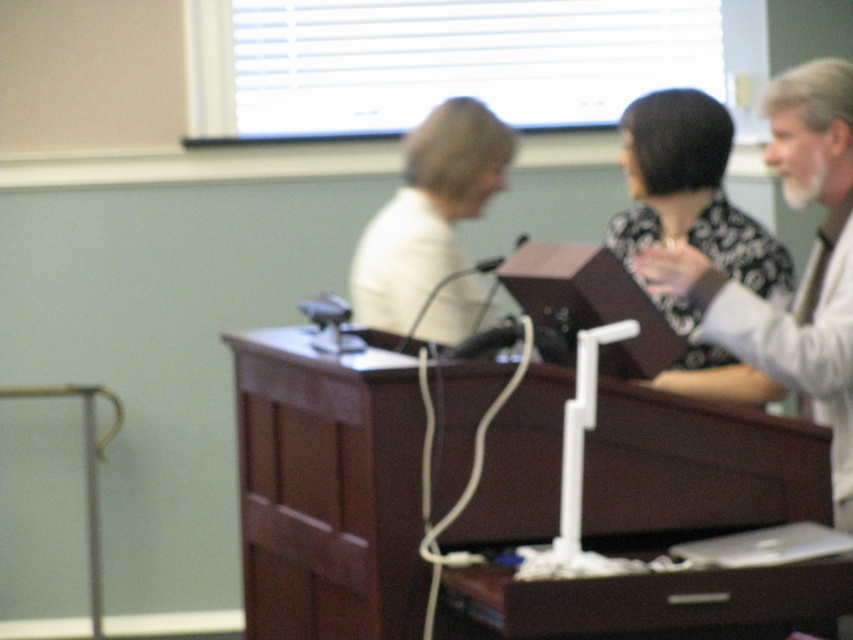
Question: Considering the real-world distances, which object is closest to the white matte shirt at center?

Choices:
 (A) dark wood table at center
 (B) black dotted dress at center
 (C) white textured shirt at upper right

Answer: (A)

Question: Can you confirm if white textured shirt at upper right is positioned above white matte shirt at center?

Choices:
 (A) yes
 (B) no

Answer: (B)

Question: Which is nearer to the white matte shirt at center?

Choices:
 (A) dark wood table at center
 (B) black dotted dress at center

Answer: (A)

Question: Which is farther from the white matte shirt at center?

Choices:
 (A) white textured shirt at upper right
 (B) black dotted dress at center

Answer: (A)

Question: Can you confirm if black dotted dress at center is wider than white matte shirt at center?

Choices:
 (A) no
 (B) yes

Answer: (A)

Question: Does dark wood table at center lie in front of white matte shirt at center?

Choices:
 (A) no
 (B) yes

Answer: (B)